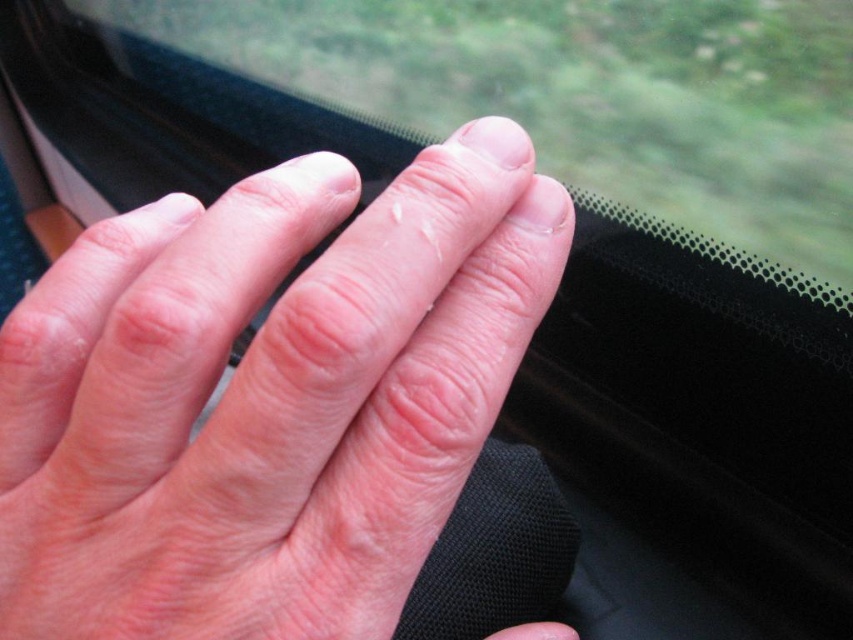
The height and width of the screenshot is (640, 853). What do you see at coordinates (265, 396) in the screenshot?
I see `pale skin at center` at bounding box center [265, 396].

Which is behind, point (24, 502) or point (593, 3)?

The point (593, 3) is more distant.

Where is `pale skin at center`? The width and height of the screenshot is (853, 640). pale skin at center is located at coordinates (265, 396).